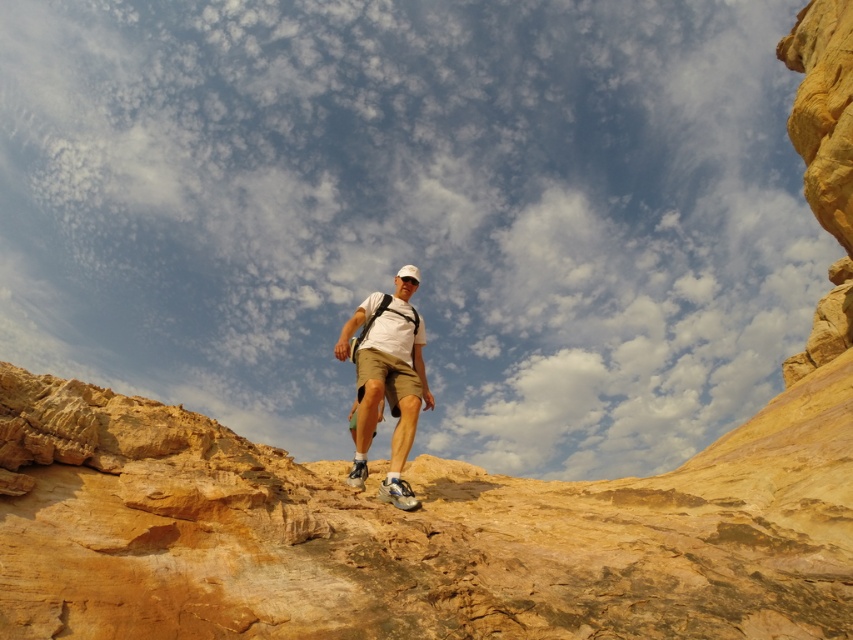
Does white matte t-shirt at center appear on the right side of light beige cotton shorts at center?

Yes, white matte t-shirt at center is to the right of light beige cotton shorts at center.

Who is more forward, (375, 419) or (360, 355)?

Positioned in front is point (375, 419).

I want to click on white matte t-shirt at center, so click(x=387, y=378).